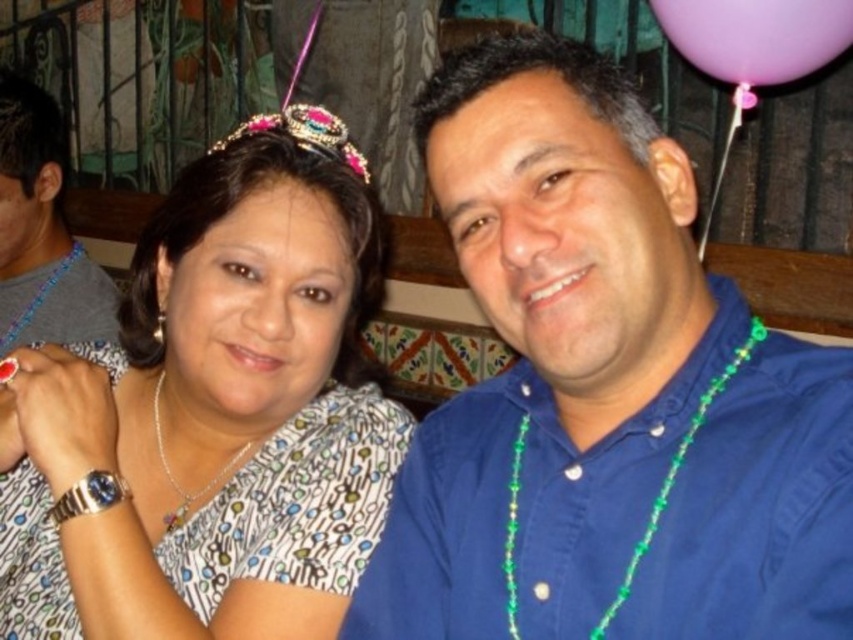
Question: Which of the following is the closest to the observer?

Choices:
 (A) silver metallic watch at left
 (B) blue matte shirt at upper right
 (C) sparkly pink and blue tiara at upper center

Answer: (B)

Question: Does purple latex balloon at upper right appear over green beaded necklace at right?

Choices:
 (A) no
 (B) yes

Answer: (B)

Question: Which object appears farthest from the camera in this image?

Choices:
 (A) white printed blouse at center
 (B) purple latex balloon at upper right

Answer: (B)

Question: Does silver metallic watch at left appear on the left side of silver/glass necklace at center?

Choices:
 (A) no
 (B) yes

Answer: (B)

Question: Is blue matte shirt at upper right smaller than green beaded necklace at right?

Choices:
 (A) yes
 (B) no

Answer: (B)

Question: Which point is farther from the camera taking this photo?

Choices:
 (A) (590, 134)
 (B) (100, 595)

Answer: (B)